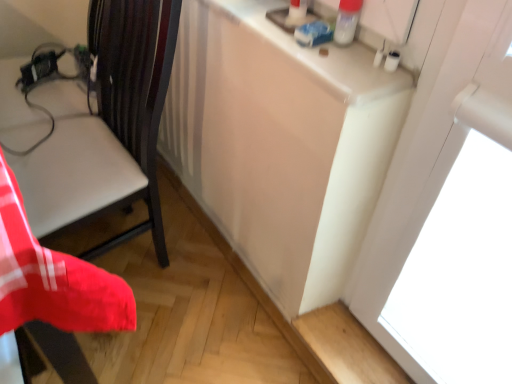
Question: Is the position of matte black chair at left more distant than that of white glossy counter top at upper right?

Choices:
 (A) yes
 (B) no

Answer: (B)

Question: Does matte black chair at left have a greater width compared to white glossy counter top at upper right?

Choices:
 (A) yes
 (B) no

Answer: (A)

Question: Is matte black chair at left to the left of white glossy counter top at upper right from the viewer's perspective?

Choices:
 (A) yes
 (B) no

Answer: (A)

Question: Is matte black chair at left positioned far away from white glossy counter top at upper right?

Choices:
 (A) yes
 (B) no

Answer: (B)

Question: Can you confirm if matte black chair at left is bigger than white glossy counter top at upper right?

Choices:
 (A) no
 (B) yes

Answer: (B)

Question: Is matte black chair at left positioned with its back to white glossy counter top at upper right?

Choices:
 (A) no
 (B) yes

Answer: (A)

Question: From the image's perspective, is white glossy counter top at upper right beneath matte black chair at left?

Choices:
 (A) no
 (B) yes

Answer: (A)

Question: Considering the relative sizes of white glossy counter top at upper right and matte black chair at left in the image provided, is white glossy counter top at upper right shorter than matte black chair at left?

Choices:
 (A) yes
 (B) no

Answer: (A)

Question: Is white glossy counter top at upper right smaller than matte black chair at left?

Choices:
 (A) no
 (B) yes

Answer: (B)

Question: Does white glossy counter top at upper right have a lesser width compared to matte black chair at left?

Choices:
 (A) no
 (B) yes

Answer: (B)

Question: Is matte black chair at left located within white glossy counter top at upper right?

Choices:
 (A) no
 (B) yes

Answer: (A)

Question: Is white glossy counter top at upper right with matte black chair at left?

Choices:
 (A) yes
 (B) no

Answer: (B)

Question: Would you say white glossy counter top at upper right is inside or outside matte black chair at left?

Choices:
 (A) inside
 (B) outside

Answer: (B)